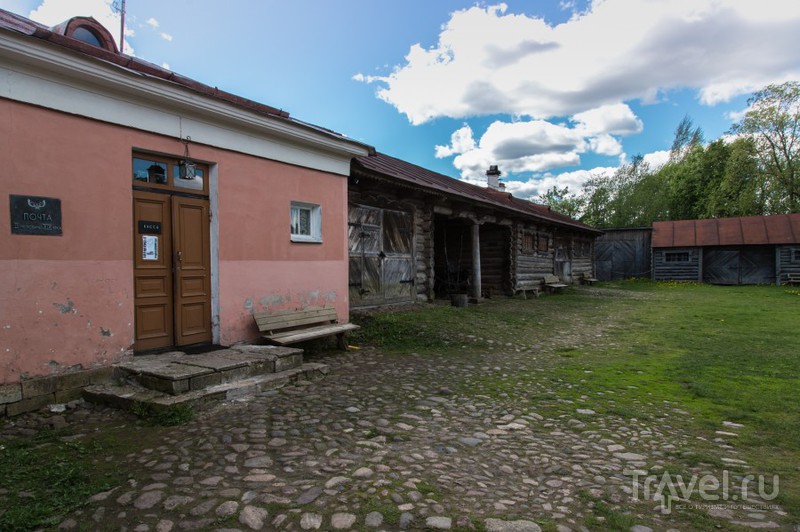
This screenshot has width=800, height=532. I want to click on bench, so click(x=281, y=317).